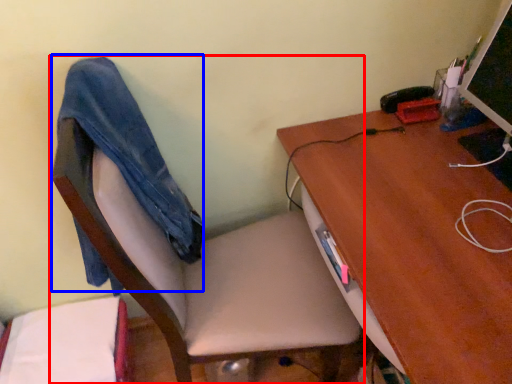
Question: Which point is further to the camera, chair (highlighted by a red box) or jeans (highlighted by a blue box)?

Choices:
 (A) chair
 (B) jeans

Answer: (B)